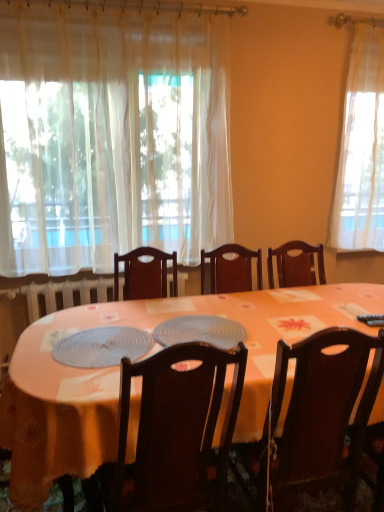
Question: Can you confirm if white sheer curtain at upper left is bigger than translucent plastic placemat at center, marked as the 2th platter in a left-to-right arrangement?

Choices:
 (A) yes
 (B) no

Answer: (A)

Question: From a real-world perspective, is white sheer curtain at upper left physically above translucent plastic placemat at center, marked as the first platter in a right-to-left arrangement?

Choices:
 (A) yes
 (B) no

Answer: (A)

Question: Considering the relative sizes of white sheer curtain at upper left and translucent plastic placemat at center, marked as the 2th platter in a left-to-right arrangement, in the image provided, is white sheer curtain at upper left taller than translucent plastic placemat at center, marked as the 2th platter in a left-to-right arrangement,?

Choices:
 (A) no
 (B) yes

Answer: (B)

Question: From the image's perspective, is white sheer curtain at upper left beneath translucent plastic placemat at center, marked as the 2th platter in a left-to-right arrangement?

Choices:
 (A) yes
 (B) no

Answer: (B)

Question: Is white sheer curtain at upper left positioned behind translucent plastic placemat at center, marked as the 2th platter in a left-to-right arrangement?

Choices:
 (A) no
 (B) yes

Answer: (B)

Question: Can you confirm if white sheer curtain at upper left is wider than translucent plastic placemat at center, marked as the first platter in a right-to-left arrangement?

Choices:
 (A) no
 (B) yes

Answer: (A)

Question: Is orange fabric table at center a part of dark wood chair at center, arranged as the 2th chair when viewed from the right?

Choices:
 (A) no
 (B) yes

Answer: (A)

Question: Is dark wood chair at center, arranged as the 2th chair when viewed from the right, positioned in front of orange fabric table at center?

Choices:
 (A) yes
 (B) no

Answer: (A)

Question: Could you tell me if dark wood chair at center, which is counted as the first chair, starting from the left, is turned towards orange fabric table at center?

Choices:
 (A) no
 (B) yes

Answer: (B)

Question: Considering the relative sizes of dark wood chair at center, arranged as the 2th chair when viewed from the right, and orange fabric table at center in the image provided, is dark wood chair at center, arranged as the 2th chair when viewed from the right, bigger than orange fabric table at center?

Choices:
 (A) no
 (B) yes

Answer: (A)

Question: From the image's perspective, is dark wood chair at center, which is counted as the first chair, starting from the left, on top of orange fabric table at center?

Choices:
 (A) yes
 (B) no

Answer: (A)

Question: Does dark wood chair at center, which is counted as the first chair, starting from the left, appear on the right side of orange fabric table at center?

Choices:
 (A) yes
 (B) no

Answer: (B)

Question: Is dark wood chair at center, positioned as the second chair in left-to-right order, further to camera compared to white sheer curtain at upper left?

Choices:
 (A) no
 (B) yes

Answer: (A)